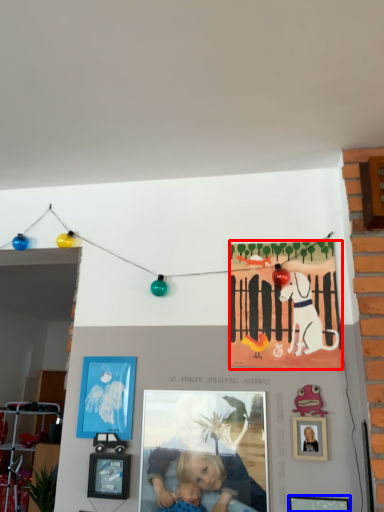
Question: Which object appears closest to the camera in this image, poster (highlighted by a red box) or picture frame (highlighted by a blue box)?

Choices:
 (A) poster
 (B) picture frame

Answer: (B)